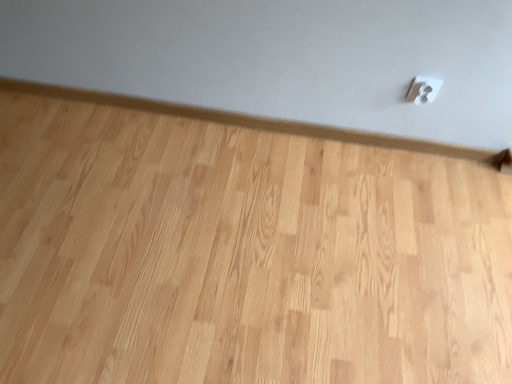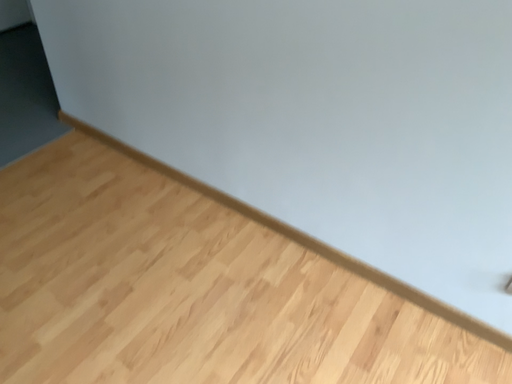
Question: Which way did the camera rotate in the video?

Choices:
 (A) rotated upward
 (B) rotated downward

Answer: (A)